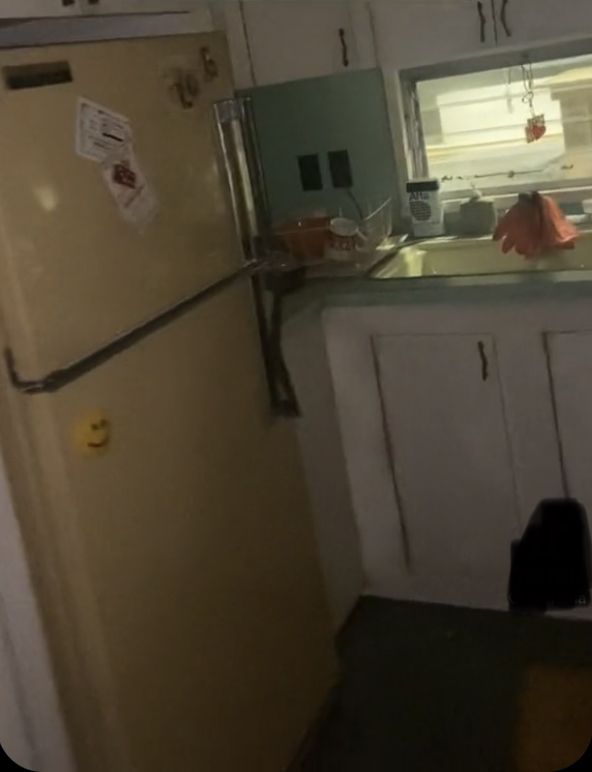
At what (x,y) coordinates should I click in order to perform the action: click on window. Please return your answer as a coordinate pair (x, y). Looking at the image, I should click on pyautogui.click(x=487, y=117).